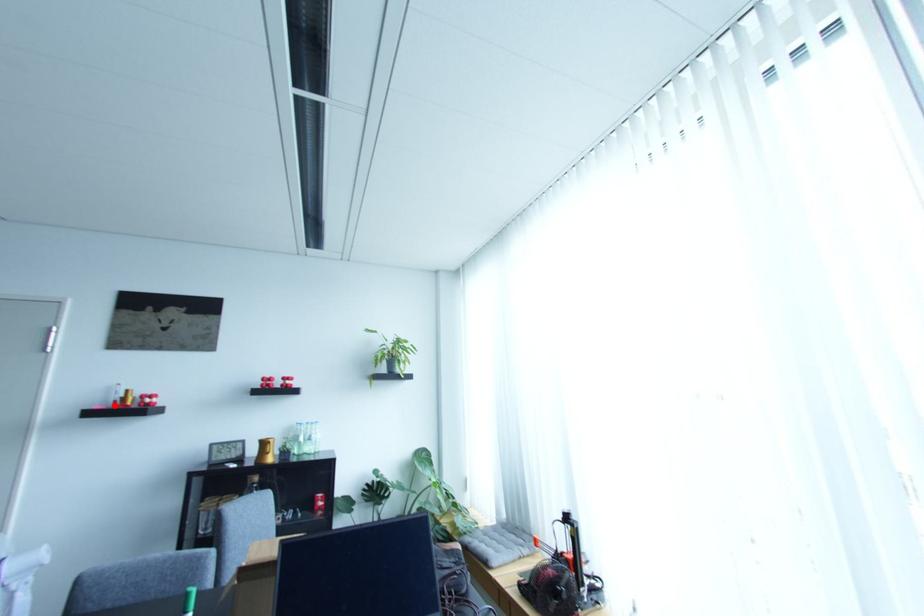
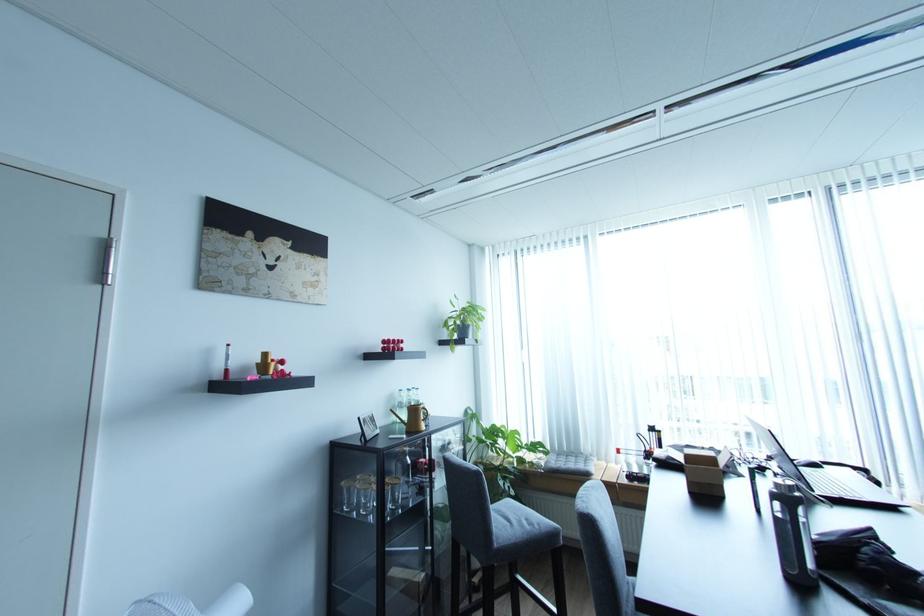
Find the pixel in the second image that matches the highlighted location in the first image.

(222, 377)